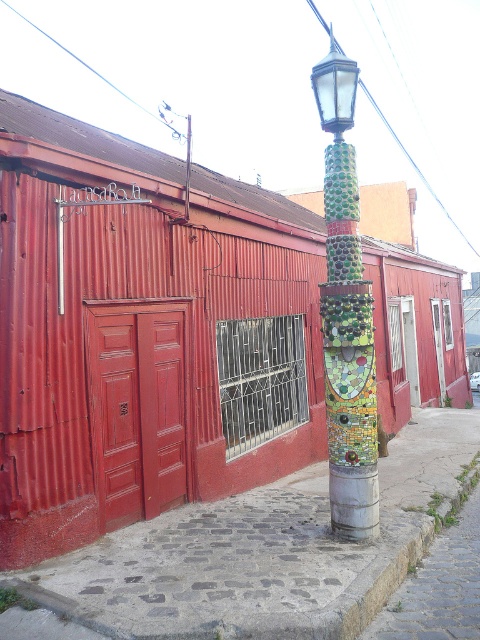
You are standing at the point marked by the coordinates point (264, 552). What is the surface material under your feet?

The surface material under your feet is cobblestone pavement at center, as indicated by the coordinates point (264, 552).

You are a delivery person trying to park your bike in front of the red corrugated metal building. The bike has a kickstand that needs to be placed on the cobblestone pavement at center. Will the kickstand be able to stabilize the bike if you park it next to the green mosaic lamp post at center?

The cobblestone pavement at center is below the green mosaic lamp post at center, so the kickstand can be placed on the pavement beneath the lamp post, allowing the bike to stabilize properly.

You are a delivery person approaching the red corrugated metal building. You need to place a heavy box on the cobblestone pavement at center and the green mosaic lamp post at center. Which location is closer to you for placing the box?

The cobblestone pavement at center is closer to you since it is further to the viewer than the green mosaic lamp post at center, meaning you can reach it sooner.